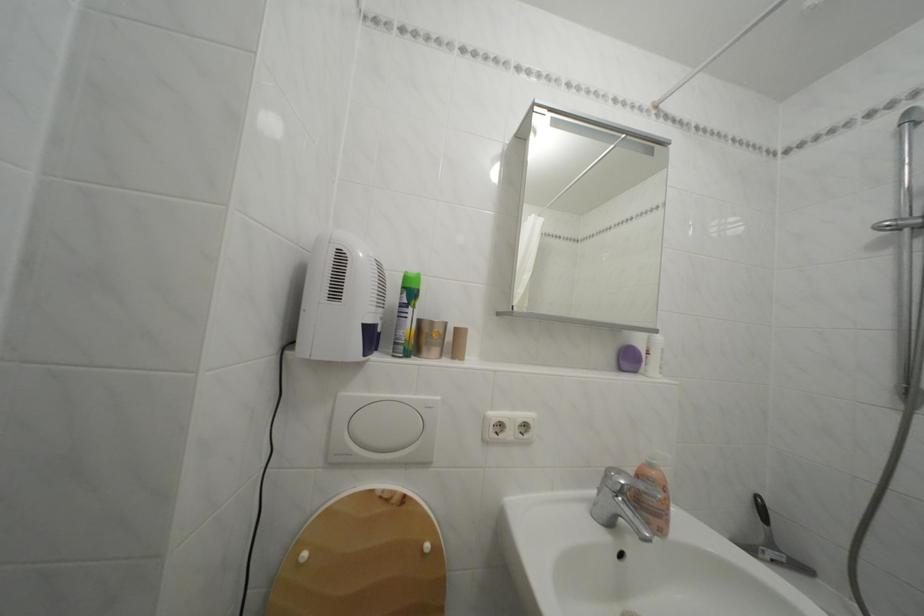
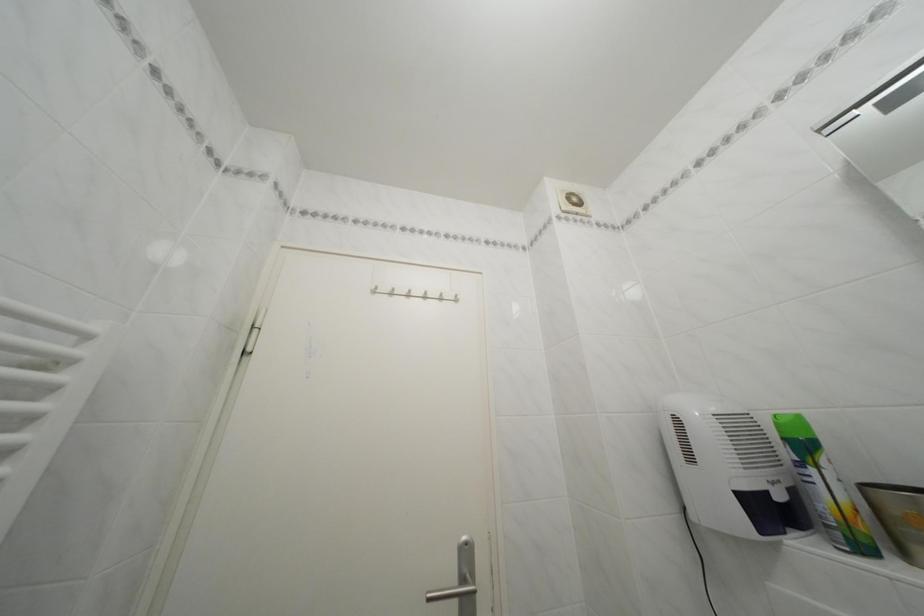
The point at (411, 294) is marked in the first image. Where is the corresponding point in the second image?

(793, 445)